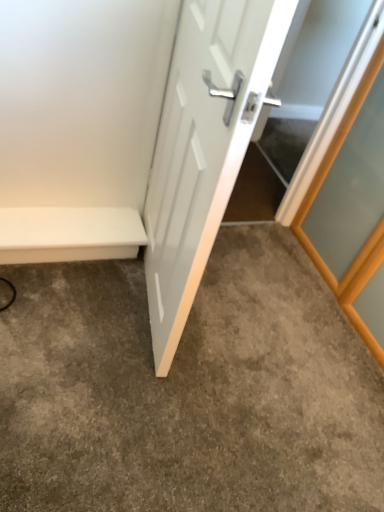
Find the location of a particular element. The width and height of the screenshot is (384, 512). gray carpet at center is located at coordinates (188, 390).

Is the surface of white glossy door at center in direct contact with white matte bench at lower left?

There is a gap between white glossy door at center and white matte bench at lower left.

Is white matte bench at lower left completely or partially inside white glossy door at center?

No, white glossy door at center does not contain white matte bench at lower left.

Between white glossy door at center and white matte bench at lower left, which one appears on the right side from the viewer's perspective?

white glossy door at center is more to the right.

Considering the sizes of white glossy door at center and white matte bench at lower left in the image, is white glossy door at center wider or thinner than white matte bench at lower left?

Clearly, white glossy door at center has less width compared to white matte bench at lower left.

How different are the orientations of white matte bench at lower left and gray carpet at center in degrees?

white matte bench at lower left and gray carpet at center are facing 179 degrees away from each other.

Looking at this image, could you tell me if white matte bench at lower left is facing gray carpet at center?

Yes, white matte bench at lower left faces towards gray carpet at center.

Is the surface of white matte bench at lower left in direct contact with gray carpet at center?

No, white matte bench at lower left is not in contact with gray carpet at center.

Which is in front, point (91, 256) or point (88, 312)?

Positioned in front is point (88, 312).

Between gray carpet at center and white glossy door at center, which one has smaller width?

Thinner between the two is white glossy door at center.

In the scene shown: What's the angular difference between gray carpet at center and white glossy door at center's facing directions?

100 degrees.

Is the position of gray carpet at center more distant than that of white glossy door at center?

Yes, gray carpet at center is further from the viewer.

Do you think gray carpet at center is within white glossy door at center, or outside of it?

gray carpet at center cannot be found inside white glossy door at center.

From the image's perspective, is white glossy door at center above or below gray carpet at center?

From the image's perspective, white glossy door at center appears above gray carpet at center.

Is gray carpet at center located within white glossy door at center?

That's incorrect, gray carpet at center is not inside white glossy door at center.

You are a GUI agent. You are given a task and a screenshot of the screen. Output one action in this format:
    pyautogui.click(x=<x>, y=<y>)
    Task: Click on the concrete that appears on the right of white glossy door at center
    The width and height of the screenshot is (384, 512).
    Given the screenshot: What is the action you would take?
    pyautogui.click(x=188, y=390)

Does white matte bench at lower left have a greater height compared to white glossy door at center?

Incorrect, the height of white matte bench at lower left is not larger of that of white glossy door at center.

Consider the image. Is white matte bench at lower left looking in the opposite direction of white glossy door at center?

No, white glossy door at center is not at the back of white matte bench at lower left.

From the image's perspective, which is above, white matte bench at lower left or white glossy door at center?

white glossy door at center.

Which object is thinner, white matte bench at lower left or white glossy door at center?

Thinner between the two is white glossy door at center.

Which is in front, point (141, 397) or point (78, 256)?

The point (141, 397) is in front.

From a real-world perspective, which object rests below the other?

In real-world perspective, gray carpet at center is lower.

In the image, is gray carpet at center positioned in front of or behind white matte bench at lower left?

In the image, gray carpet at center appears in front of white matte bench at lower left.

I want to click on concrete on the right of white matte bench at lower left, so click(188, 390).

The image size is (384, 512). Find the location of `balustrade below the white glossy door at center (from a real-world perspective)`. balustrade below the white glossy door at center (from a real-world perspective) is located at coordinates (69, 234).

I want to click on balustrade located above the gray carpet at center (from a real-world perspective), so click(x=69, y=234).

Looking at the image, which one is located further to white glossy door at center, white matte bench at lower left or gray carpet at center?

gray carpet at center is further to white glossy door at center.

Looking at this image, looking at the image, which one is located closer to gray carpet at center, white matte bench at lower left or white glossy door at center?

white matte bench at lower left is closer to gray carpet at center.

Based on the photo, from the image, which object appears to be farther from white matte bench at lower left, white glossy door at center or gray carpet at center?

The object further to white matte bench at lower left is white glossy door at center.

Based on their spatial positions, is gray carpet at center or white matte bench at lower left closer to white glossy door at center?

white matte bench at lower left lies closer to white glossy door at center than the other object.

Based on the photo, when comparing their distances from white matte bench at lower left, does gray carpet at center or white glossy door at center seem further?

white glossy door at center is positioned further to the anchor white matte bench at lower left.

When comparing their distances from gray carpet at center, does white glossy door at center or white matte bench at lower left seem closer?

Based on the image, white matte bench at lower left appears to be nearer to gray carpet at center.

Locate an element on the screen. The image size is (384, 512). concrete located between white glossy door at center and white matte bench at lower left in the depth direction is located at coordinates (188, 390).